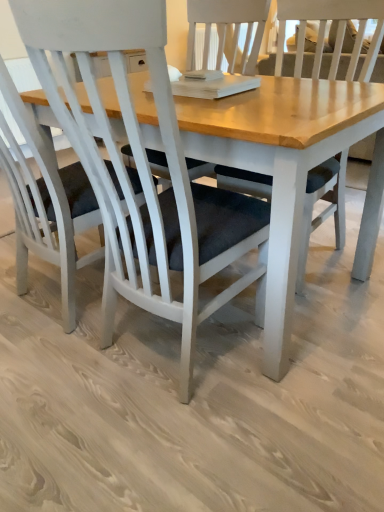
Locate an element on the screen. This screenshot has height=512, width=384. vacant area located to the right-hand side of white matte chair at center, which is counted as the 1th chair, starting from the right is located at coordinates (318, 354).